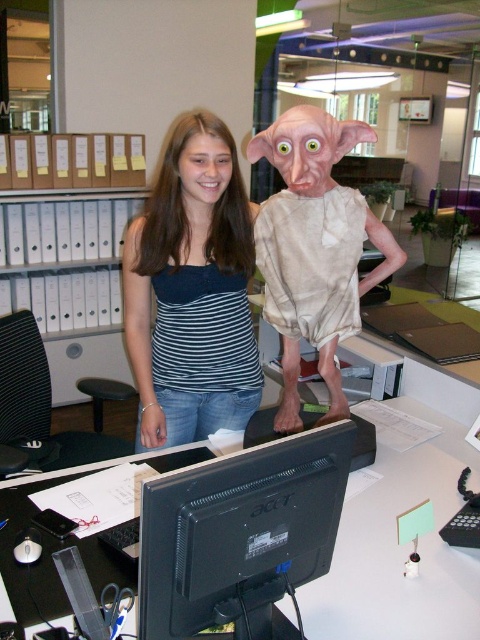
Is point (225, 269) closer to camera compared to point (212, 548)?

No.

Between point (226, 403) and point (152, 564), which one is positioned in front?

Point (152, 564)

Where is `striped fabric tank top at center`? This screenshot has width=480, height=640. striped fabric tank top at center is located at coordinates (192, 291).